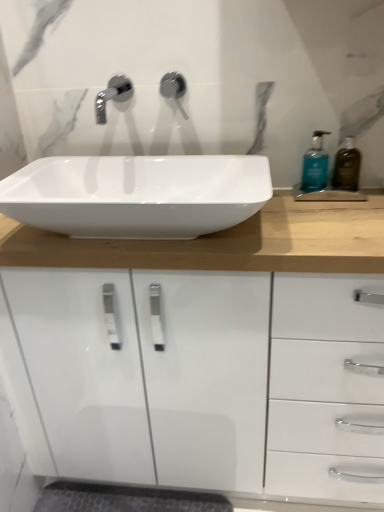
The width and height of the screenshot is (384, 512). Identify the location of translucent amber bottle at right, marked as the 2th soap dispenser in a left-to-right arrangement. (347, 166).

This screenshot has width=384, height=512. What do you see at coordinates (347, 166) in the screenshot?
I see `translucent amber bottle at right, which ranks as the first soap dispenser in right-to-left order` at bounding box center [347, 166].

This screenshot has height=512, width=384. Describe the element at coordinates (137, 195) in the screenshot. I see `white glossy sink at center` at that location.

Locate an element on the screen. Image resolution: width=384 pixels, height=512 pixels. teal glass soap dispenser at right, the first soap dispenser positioned from the left is located at coordinates (315, 165).

Is white glossy sink at center looking in the opposite direction of teal glass soap dispenser at right, the second soap dispenser positioned from the right?

white glossy sink at center is not turned away from teal glass soap dispenser at right, the second soap dispenser positioned from the right.

Based on the photo, which of these two, white glossy sink at center or teal glass soap dispenser at right, the first soap dispenser positioned from the left, is wider?

white glossy sink at center.

From the image's perspective, between white glossy sink at center and teal glass soap dispenser at right, the second soap dispenser positioned from the right, which one is located above?

teal glass soap dispenser at right, the second soap dispenser positioned from the right, appears higher in the image.

Is matte silver faucet at upper center wider than white glossy sink at center?

No.

Is matte silver faucet at upper center oriented away from white glossy sink at center?

No, white glossy sink at center is not at the back of matte silver faucet at upper center.

Looking at this image, considering the relative sizes of matte silver faucet at upper center and white glossy sink at center in the image provided, is matte silver faucet at upper center taller than white glossy sink at center?

Yes.

Between teal glass soap dispenser at right, the second soap dispenser positioned from the right, and matte silver faucet at upper center, which one appears on the left side from the viewer's perspective?

matte silver faucet at upper center is more to the left.

Can you tell me how much teal glass soap dispenser at right, the second soap dispenser positioned from the right, and matte silver faucet at upper center differ in facing direction?

They differ by 4.52 degrees in their facing directions.

Is teal glass soap dispenser at right, the second soap dispenser positioned from the right, with matte silver faucet at upper center?

teal glass soap dispenser at right, the second soap dispenser positioned from the right, is not next to matte silver faucet at upper center, and they're not touching.

Considering the relative sizes of teal glass soap dispenser at right, the first soap dispenser positioned from the left, and matte silver faucet at upper center in the image provided, is teal glass soap dispenser at right, the first soap dispenser positioned from the left, bigger than matte silver faucet at upper center?

Yes.

Considering the relative sizes of translucent amber bottle at right, which ranks as the first soap dispenser in right-to-left order, and teal glass soap dispenser at right, the second soap dispenser positioned from the right, in the image provided, is translucent amber bottle at right, which ranks as the first soap dispenser in right-to-left order, shorter than teal glass soap dispenser at right, the second soap dispenser positioned from the right,?

Incorrect, the height of translucent amber bottle at right, which ranks as the first soap dispenser in right-to-left order, does not fall short of that of teal glass soap dispenser at right, the second soap dispenser positioned from the right.

From the picture: Which is nearer, [333,170] or [316,159]?

The point [316,159] is more forward.

Is the position of translucent amber bottle at right, which ranks as the first soap dispenser in right-to-left order, less distant than that of teal glass soap dispenser at right, the first soap dispenser positioned from the left?

Yes, translucent amber bottle at right, which ranks as the first soap dispenser in right-to-left order, is closer to the viewer.

Would you say translucent amber bottle at right, marked as the 2th soap dispenser in a left-to-right arrangement, is outside teal glass soap dispenser at right, the first soap dispenser positioned from the left?

Yes, translucent amber bottle at right, marked as the 2th soap dispenser in a left-to-right arrangement, is outside of teal glass soap dispenser at right, the first soap dispenser positioned from the left.

Find the location of a particular element. Image resolution: width=384 pixels, height=512 pixels. soap dispenser below the teal glass soap dispenser at right, the first soap dispenser positioned from the left (from a real-world perspective) is located at coordinates (347, 166).

Could you measure the distance between teal glass soap dispenser at right, the second soap dispenser positioned from the right, and translucent amber bottle at right, which ranks as the first soap dispenser in right-to-left order?

A distance of 2.09 inches exists between teal glass soap dispenser at right, the second soap dispenser positioned from the right, and translucent amber bottle at right, which ranks as the first soap dispenser in right-to-left order.

Can you confirm if teal glass soap dispenser at right, the second soap dispenser positioned from the right, is positioned to the left of translucent amber bottle at right, which ranks as the first soap dispenser in right-to-left order?

Yes.

Is teal glass soap dispenser at right, the first soap dispenser positioned from the left, positioned far away from translucent amber bottle at right, which ranks as the first soap dispenser in right-to-left order?

teal glass soap dispenser at right, the first soap dispenser positioned from the left, is actually quite close to translucent amber bottle at right, which ranks as the first soap dispenser in right-to-left order.

Choose the correct answer: Is white glossy sink at center inside matte silver faucet at upper center or outside it?

white glossy sink at center is outside matte silver faucet at upper center.

Is white glossy sink at center closer to the viewer compared to matte silver faucet at upper center?

Yes, white glossy sink at center is closer to the viewer.

Considering the relative sizes of white glossy sink at center and matte silver faucet at upper center in the image provided, is white glossy sink at center wider than matte silver faucet at upper center?

Indeed, white glossy sink at center has a greater width compared to matte silver faucet at upper center.

What's the angular difference between white glossy sink at center and matte silver faucet at upper center's facing directions?

The angle between the facing direction of white glossy sink at center and the facing direction of matte silver faucet at upper center is 0.00152 degrees.

Could you measure the distance between translucent amber bottle at right, which ranks as the first soap dispenser in right-to-left order, and white glossy sink at center?

20.58 inches.

Considering the positions of objects translucent amber bottle at right, marked as the 2th soap dispenser in a left-to-right arrangement, and white glossy sink at center in the image provided, who is in front, translucent amber bottle at right, marked as the 2th soap dispenser in a left-to-right arrangement, or white glossy sink at center?

Positioned in front is white glossy sink at center.

Is translucent amber bottle at right, which ranks as the first soap dispenser in right-to-left order, placed right next to white glossy sink at center?

No.

This screenshot has width=384, height=512. Find the location of `the 2nd soap dispenser behind the white glossy sink at center, counting from the anchor's position`. the 2nd soap dispenser behind the white glossy sink at center, counting from the anchor's position is located at coordinates [x=315, y=165].

Where is `plumbing fixture that is on the right side of white glossy sink at center`? This screenshot has width=384, height=512. plumbing fixture that is on the right side of white glossy sink at center is located at coordinates (174, 89).

Looking at the image, which one is located further to white glossy sink at center, matte silver faucet at upper center or teal glass soap dispenser at right, the second soap dispenser positioned from the right?

The object further to white glossy sink at center is teal glass soap dispenser at right, the second soap dispenser positioned from the right.

Based on their spatial positions, is teal glass soap dispenser at right, the second soap dispenser positioned from the right, or white glossy sink at center closer to matte silver faucet at upper center?

white glossy sink at center is closer to matte silver faucet at upper center.

From the picture: Considering their positions, is white glossy sink at center positioned closer to teal glass soap dispenser at right, the first soap dispenser positioned from the left, than translucent amber bottle at right, marked as the 2th soap dispenser in a left-to-right arrangement?

translucent amber bottle at right, marked as the 2th soap dispenser in a left-to-right arrangement, is closer to teal glass soap dispenser at right, the first soap dispenser positioned from the left.

Looking at the image, which one is located further to matte silver faucet at upper center, teal glass soap dispenser at right, the first soap dispenser positioned from the left, or translucent amber bottle at right, which ranks as the first soap dispenser in right-to-left order?

Among the two, translucent amber bottle at right, which ranks as the first soap dispenser in right-to-left order, is located further to matte silver faucet at upper center.

When comparing their distances from teal glass soap dispenser at right, the second soap dispenser positioned from the right, does matte silver faucet at upper center or translucent amber bottle at right, marked as the 2th soap dispenser in a left-to-right arrangement, seem closer?

The object closer to teal glass soap dispenser at right, the second soap dispenser positioned from the right, is translucent amber bottle at right, marked as the 2th soap dispenser in a left-to-right arrangement.

From the image, which object appears to be nearer to matte silver faucet at upper center, translucent amber bottle at right, marked as the 2th soap dispenser in a left-to-right arrangement, or teal glass soap dispenser at right, the second soap dispenser positioned from the right?

Based on the image, teal glass soap dispenser at right, the second soap dispenser positioned from the right, appears to be nearer to matte silver faucet at upper center.

Which object lies further to the anchor point translucent amber bottle at right, marked as the 2th soap dispenser in a left-to-right arrangement, teal glass soap dispenser at right, the first soap dispenser positioned from the left, or matte silver faucet at upper center?

matte silver faucet at upper center is positioned further to the anchor translucent amber bottle at right, marked as the 2th soap dispenser in a left-to-right arrangement.

Estimate the real-world distances between objects in this image. Which object is further from translucent amber bottle at right, marked as the 2th soap dispenser in a left-to-right arrangement, matte silver faucet at upper center or white glossy sink at center?

white glossy sink at center.

You are a GUI agent. You are given a task and a screenshot of the screen. Output one action in this format:
    pyautogui.click(x=<x>, y=<y>)
    Task: Click on the plumbing fixture located between white glossy sink at center and teal glass soap dispenser at right, the second soap dispenser positioned from the right, in the left-right direction
    
    Given the screenshot: What is the action you would take?
    pyautogui.click(x=174, y=89)

Locate an element on the screen. soap dispenser between matte silver faucet at upper center and translucent amber bottle at right, marked as the 2th soap dispenser in a left-to-right arrangement is located at coordinates (315, 165).

Locate an element on the screen. This screenshot has height=512, width=384. plumbing fixture located between white glossy sink at center and translucent amber bottle at right, marked as the 2th soap dispenser in a left-to-right arrangement, in the left-right direction is located at coordinates (174, 89).

Image resolution: width=384 pixels, height=512 pixels. Identify the location of soap dispenser located between white glossy sink at center and translucent amber bottle at right, marked as the 2th soap dispenser in a left-to-right arrangement, in the left-right direction. (315, 165).